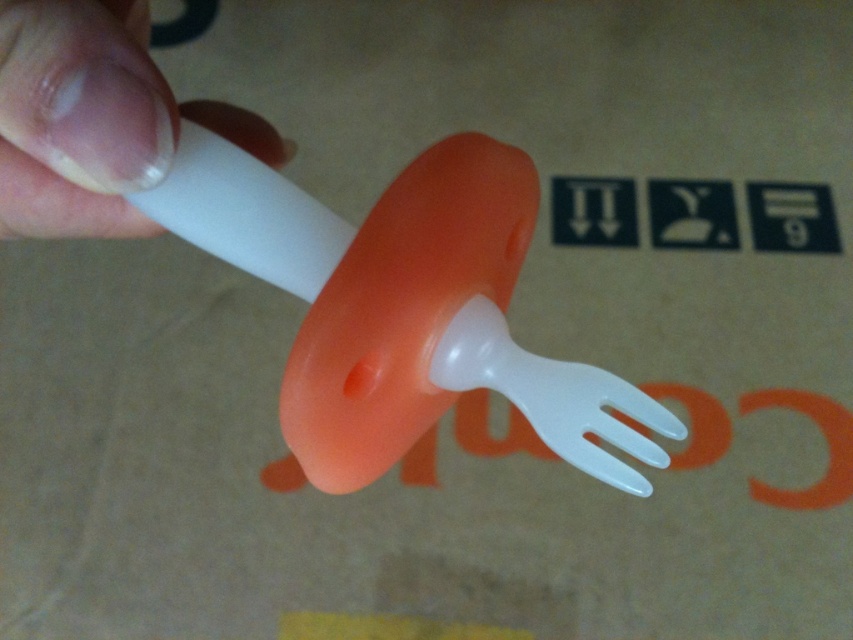
You are organizing a picnic and have both the translucent plastic fork at center and the white matte plastic at upper left. Which item is larger in size?

The translucent plastic fork at center is bigger than the white matte plastic at upper left.

You are trying to determine the order of the symbols on the cardboard background. You see two points labeled as point (x=299, y=440) and point (x=80, y=100). Which point is closer to you?

Point (x=80, y=100) is closer to you because point (x=299, y=440) is behind it.

Based on the scene description, what is the exact position of the translucent plastic fork at center?

The translucent plastic fork at center is located at point (399, 307).